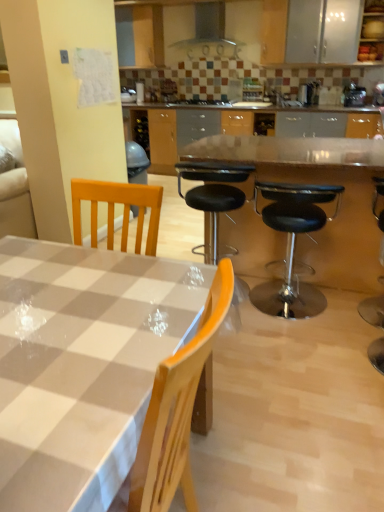
Question: Considering the relative sizes of metallic silver toaster at upper right and transparent glass table at center in the image provided, is metallic silver toaster at upper right smaller than transparent glass table at center?

Choices:
 (A) yes
 (B) no

Answer: (A)

Question: Considering the relative positions of metallic silver toaster at upper right and transparent glass table at center in the image provided, is metallic silver toaster at upper right to the left of transparent glass table at center from the viewer's perspective?

Choices:
 (A) yes
 (B) no

Answer: (B)

Question: Is transparent glass table at center inside metallic silver toaster at upper right?

Choices:
 (A) yes
 (B) no

Answer: (B)

Question: Can you confirm if metallic silver toaster at upper right is thinner than transparent glass table at center?

Choices:
 (A) yes
 (B) no

Answer: (A)

Question: Considering the relative sizes of metallic silver toaster at upper right and transparent glass table at center in the image provided, is metallic silver toaster at upper right taller than transparent glass table at center?

Choices:
 (A) no
 (B) yes

Answer: (A)

Question: From a real-world perspective, does metallic silver toaster at upper right sit lower than transparent glass table at center?

Choices:
 (A) no
 (B) yes

Answer: (A)

Question: From the image's perspective, does black leather stool at center, marked as the 1th chair in a right-to-left arrangement, appear lower than checkered plastic table at center?

Choices:
 (A) yes
 (B) no

Answer: (B)

Question: Can you confirm if black leather stool at center, the second chair in the left-to-right sequence, is smaller than checkered plastic table at center?

Choices:
 (A) no
 (B) yes

Answer: (B)

Question: Is the position of black leather stool at center, marked as the 1th chair in a right-to-left arrangement, more distant than that of checkered plastic table at center?

Choices:
 (A) no
 (B) yes

Answer: (B)

Question: Considering the relative positions of black leather stool at center, marked as the 1th chair in a right-to-left arrangement, and checkered plastic table at center in the image provided, is black leather stool at center, marked as the 1th chair in a right-to-left arrangement, to the right of checkered plastic table at center from the viewer's perspective?

Choices:
 (A) no
 (B) yes

Answer: (B)

Question: Considering the relative positions of black leather stool at center, marked as the 1th chair in a right-to-left arrangement, and checkered plastic table at center in the image provided, is black leather stool at center, marked as the 1th chair in a right-to-left arrangement, to the left of checkered plastic table at center from the viewer's perspective?

Choices:
 (A) yes
 (B) no

Answer: (B)

Question: Could you tell me if black leather stool at center, marked as the 1th chair in a right-to-left arrangement, is facing checkered plastic table at center?

Choices:
 (A) yes
 (B) no

Answer: (B)

Question: Considering the relative sizes of black leather bar stool at right and wooden cabinet at upper right in the image provided, is black leather bar stool at right smaller than wooden cabinet at upper right?

Choices:
 (A) no
 (B) yes

Answer: (B)